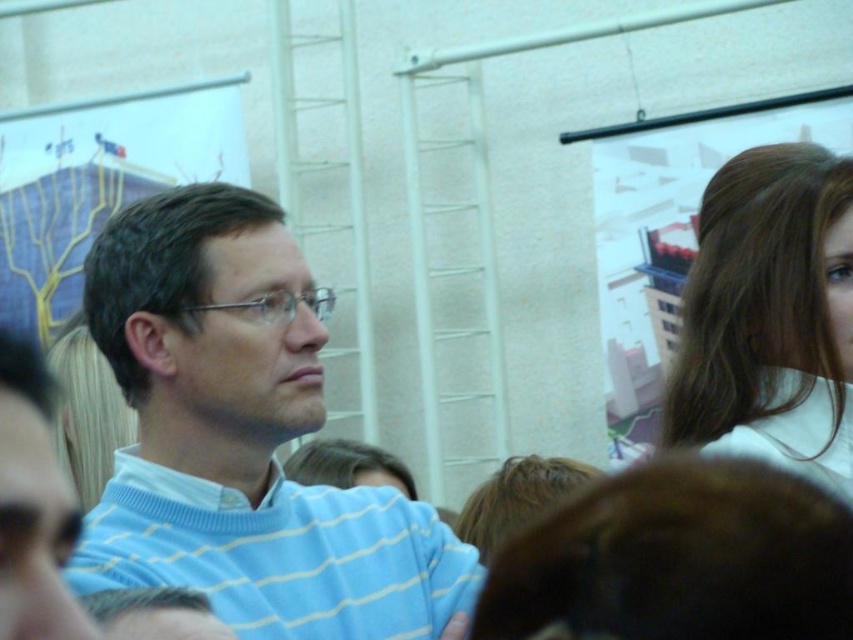
You are standing in the crowd at this event and notice the light blue striped sweater at center and the brown hair at upper right. Which object is positioned higher in the image?

The light blue striped sweater at center is much taller than the brown hair at upper right, so it is positioned higher in the image.

You are organizing a clothing donation drive and need to categorize items based on their size. You have a light blue striped sweater at center and a brown hair at upper right. Which item is wider?

The light blue striped sweater at center is wider than the brown hair at upper right.